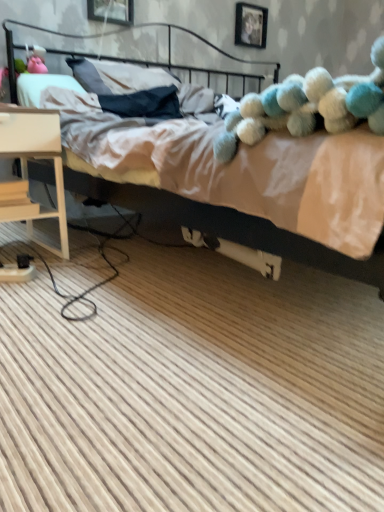
Image resolution: width=384 pixels, height=512 pixels. I want to click on spots to the right of light wood nightstand at lower left, so click(99, 260).